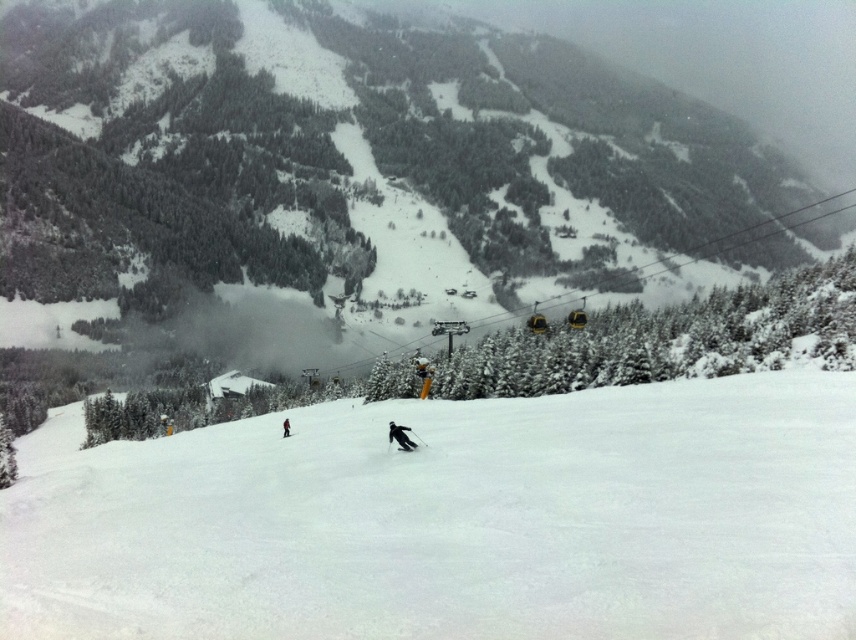
Question: Which is farther from the red fabric jacket at center?

Choices:
 (A) white snow ski slope at center
 (B) black matte skier at center

Answer: (A)

Question: Does white snow ski slope at center appear on the left side of red fabric jacket at center?

Choices:
 (A) yes
 (B) no

Answer: (B)

Question: Which object appears farthest from the camera in this image?

Choices:
 (A) black matte skier at center
 (B) white snow ski slope at center
 (C) black matte ski at center
 (D) red fabric jacket at center

Answer: (D)

Question: Which object appears closest to the camera in this image?

Choices:
 (A) red fabric jacket at center
 (B) black matte skier at center
 (C) black matte ski at center

Answer: (C)

Question: Is red fabric jacket at center smaller than black matte ski at center?

Choices:
 (A) no
 (B) yes

Answer: (A)

Question: Is black matte skier at center thinner than black matte ski at center?

Choices:
 (A) no
 (B) yes

Answer: (A)